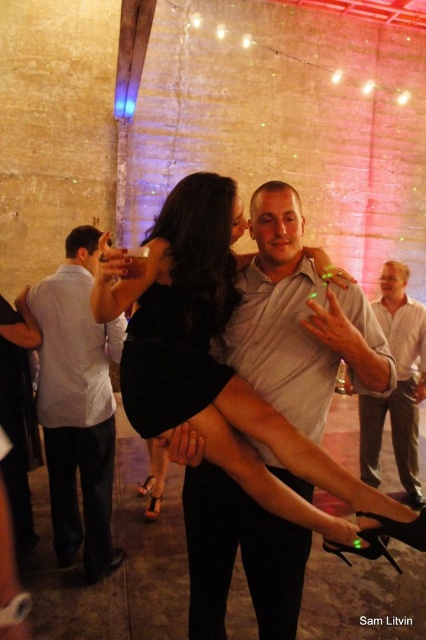
Based on the photo, which of these two, white cotton shirt at left or white shirt at upper center, stands shorter?

white shirt at upper center is shorter.

Can you confirm if white cotton shirt at left is positioned above white shirt at upper center?

Yes.

Based on the photo, who is more distant from viewer, [63,340] or [411,406]?

Point [411,406]

Identify the location of white cotton shirt at left. Image resolution: width=426 pixels, height=640 pixels. coord(77,406).

Which is behind, point (198, 488) or point (368, 465)?

Positioned behind is point (368, 465).

Which is more to the right, matte white shirt at center or white shirt at upper center?

white shirt at upper center

Measure the distance between point (215, 481) and camera.

They are 2.83 meters apart.

I want to click on matte white shirt at center, so point(241,556).

Who is positioned more to the right, matte white shirt at center or white cotton shirt at left?

matte white shirt at center is more to the right.

Who is more distant from viewer, (x=255, y=371) or (x=54, y=545)?

Positioned behind is point (x=54, y=545).

Does point (203, 484) come closer to viewer compared to point (55, 340)?

That is True.

Image resolution: width=426 pixels, height=640 pixels. Identify the location of matte white shirt at center. (241, 556).